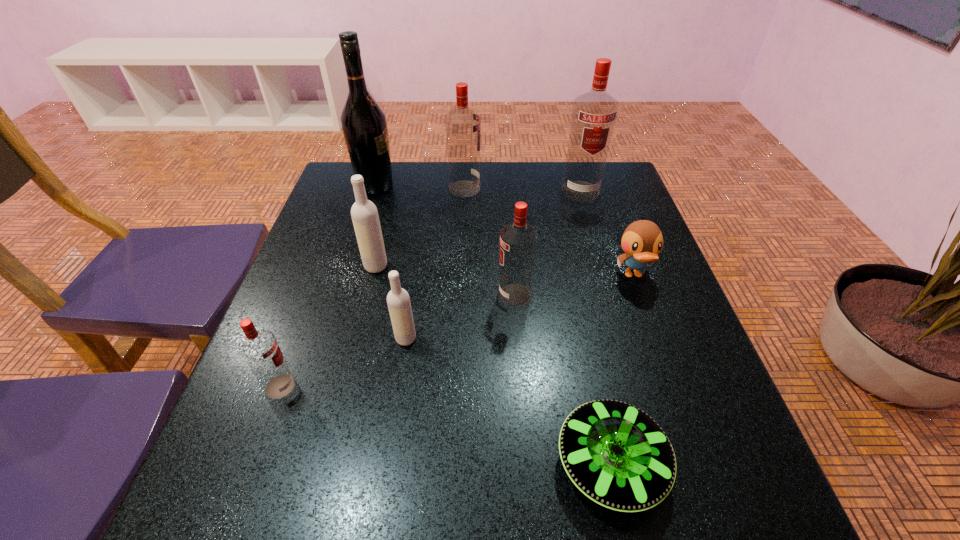
You are a GUI agent. You are given a task and a screenshot of the screen. Output one action in this format:
    pyautogui.click(x=<x>, y=<y>)
    Task: Click on the free space located 0.220m on the front of the left white vodka
    This screenshot has height=540, width=960.
    Given the screenshot: What is the action you would take?
    pyautogui.click(x=354, y=352)

I want to click on free location located 0.250m on the front label of the second smallest red vodka, so click(x=385, y=295).

Image resolution: width=960 pixels, height=540 pixels. In order to click on free space located on the front label of the second smallest red vodka in this screenshot , I will do `click(462, 295)`.

Where is `vacant space located on the front label of the second smallest red vodka`? The height and width of the screenshot is (540, 960). vacant space located on the front label of the second smallest red vodka is located at coordinates (344, 295).

This screenshot has width=960, height=540. Identify the location of free location located on the front label of the nearest vodka. (388, 386).

Find the location of a particular element. The image size is (960, 540). vacant space located 0.080m on the front of the nearer white vodka is located at coordinates (399, 382).

Find the location of a particular element. The image size is (960, 540). blank area located 0.200m on the front-facing side of the blue duck is located at coordinates (667, 367).

The image size is (960, 540). Identify the location of vacant region located on the back of the nearest object. pyautogui.click(x=568, y=266).

The image size is (960, 540). I want to click on wine bottle that is at the far edge, so click(x=363, y=121).

Identify the location of object located in the near edge section of the desktop. (617, 455).